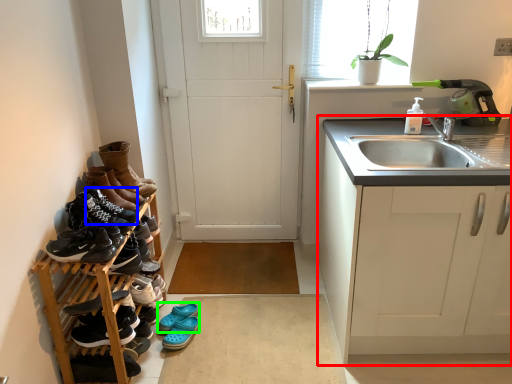
Question: Which object is the closest to the cabinetry (highlighted by a red box)? Choose among these: shoe (highlighted by a blue box) or footwear (highlighted by a green box).

Choices:
 (A) shoe
 (B) footwear

Answer: (B)